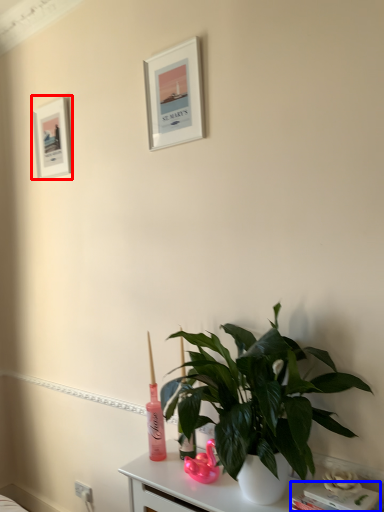
Question: Which of the following is the closest to the observer, picture frame (highlighted by a red box) or book (highlighted by a blue box)?

Choices:
 (A) picture frame
 (B) book

Answer: (B)